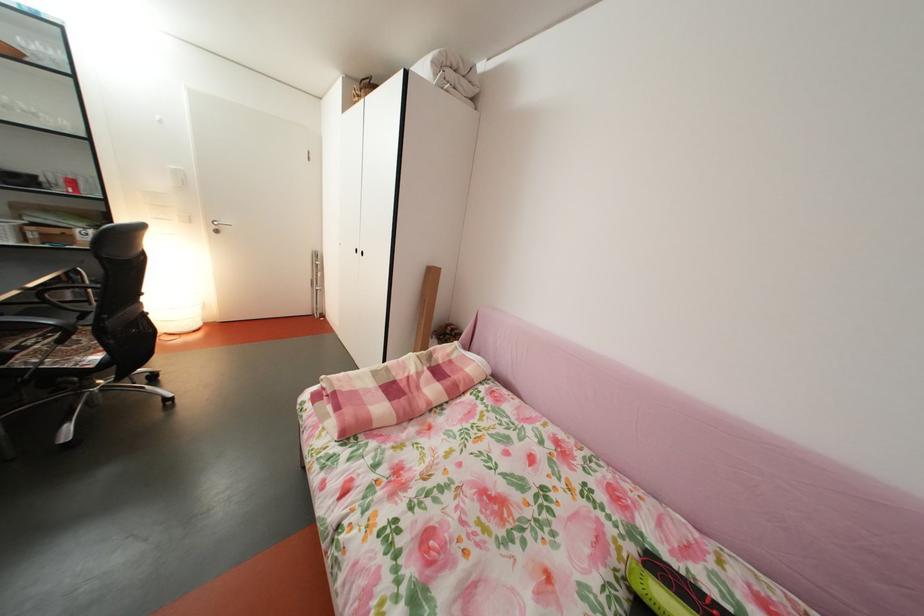
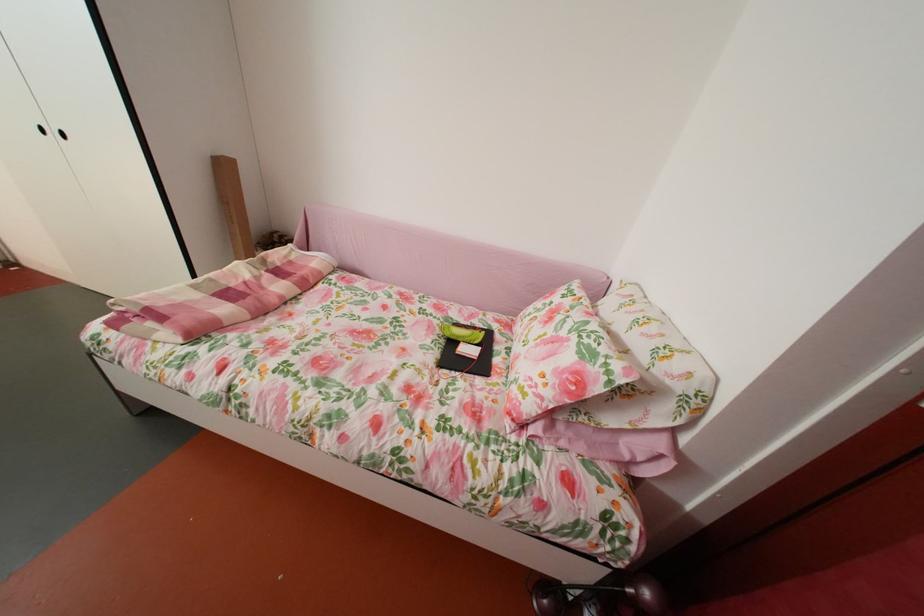
In the second image, find the point that corresponds to the point at 676,562 in the first image.

(473, 328)